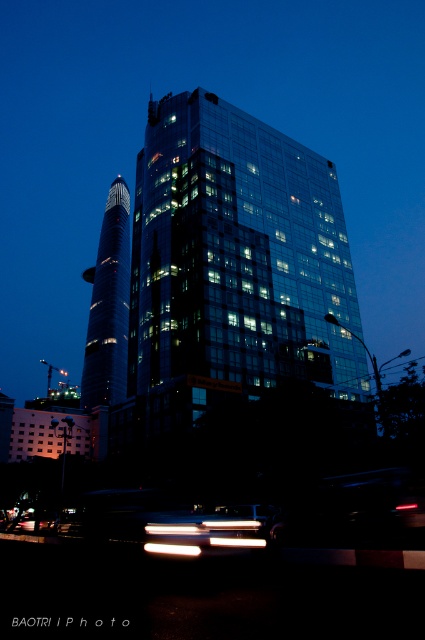
Between black glass tower at left and metallic silver car at lower center, which one appears on the right side from the viewer's perspective?

metallic silver car at lower center is more to the right.

Does point (91, 369) lie behind point (198, 536)?

Yes.

At what (x,y) coordinates should I click in order to perform the action: click on black glass tower at left. Please return your answer as a coordinate pair (x, y). The width and height of the screenshot is (425, 640). Looking at the image, I should click on (108, 305).

Is transparent glass building at center bigger than metallic silver car at lower center?

Indeed, transparent glass building at center has a larger size compared to metallic silver car at lower center.

Can you confirm if transparent glass building at center is taller than metallic silver car at lower center?

Indeed, transparent glass building at center has a greater height compared to metallic silver car at lower center.

Is point (291, 291) more distant than point (159, 525)?

Yes.

In order to click on transparent glass building at center in this screenshot , I will do `click(237, 268)`.

Does metallic silver car at lower center have a greater height compared to white glossy light at center?

Yes, metallic silver car at lower center is taller than white glossy light at center.

Does metallic silver car at lower center have a smaller size compared to white glossy light at center?

Actually, metallic silver car at lower center might be larger than white glossy light at center.

Which is behind, point (246, 515) or point (169, 554)?

The point (246, 515) is behind.

In order to click on metallic silver car at lower center in this screenshot , I will do `click(209, 531)`.